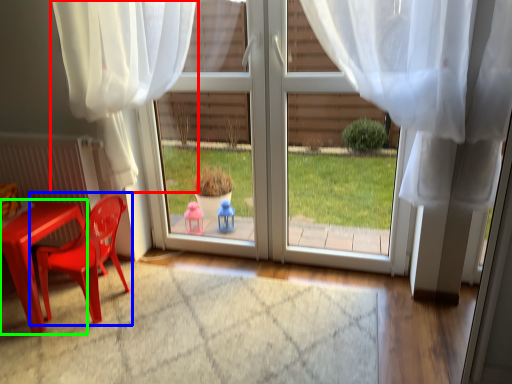
Question: Based on their relative distances, which object is nearer to curtain (highlighted by a red box)? Choose from chair (highlighted by a blue box) and table (highlighted by a green box).

Choices:
 (A) chair
 (B) table

Answer: (A)